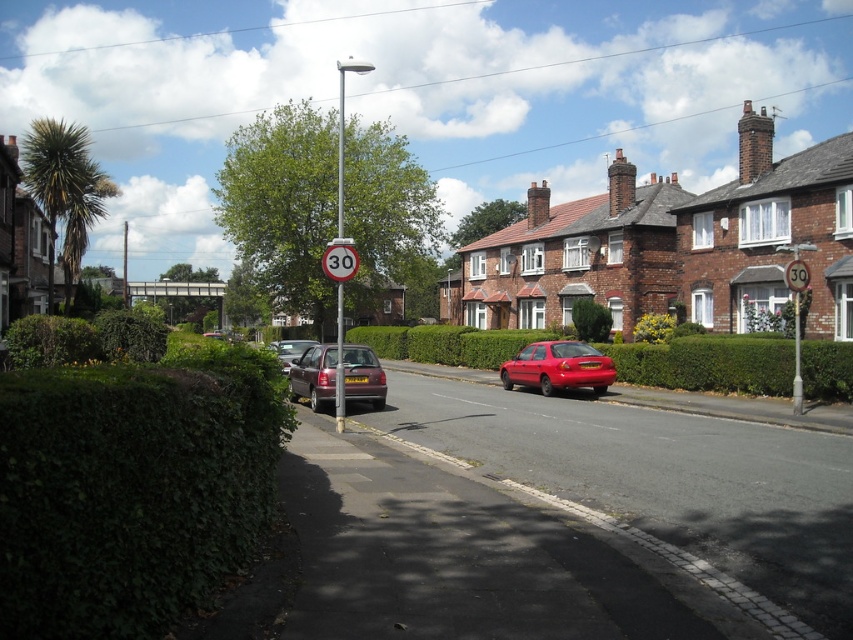
Question: Which point appears farthest from the camera in this image?

Choices:
 (A) (601, 378)
 (B) (306, 348)
 (C) (338, 237)
 (D) (798, 349)

Answer: (B)

Question: Does metallic silver car at center appear over metallic circular sign at center?

Choices:
 (A) yes
 (B) no

Answer: (B)

Question: Which of the following is the farthest from the observer?

Choices:
 (A) (x=19, y=384)
 (B) (x=556, y=385)
 (C) (x=274, y=342)
 (D) (x=793, y=289)

Answer: (C)

Question: Can you confirm if white plastic sign at center is positioned above metallic circular sign at center?

Choices:
 (A) no
 (B) yes

Answer: (A)

Question: Does green leafy hedge at left have a larger size compared to metallic circular sign at center?

Choices:
 (A) no
 (B) yes

Answer: (B)

Question: Which of the following is the farthest from the observer?

Choices:
 (A) metallic silver car at center
 (B) white plastic sign at center
 (C) metallic red speed limit sign at center
 (D) green leafy hedge at left

Answer: (B)